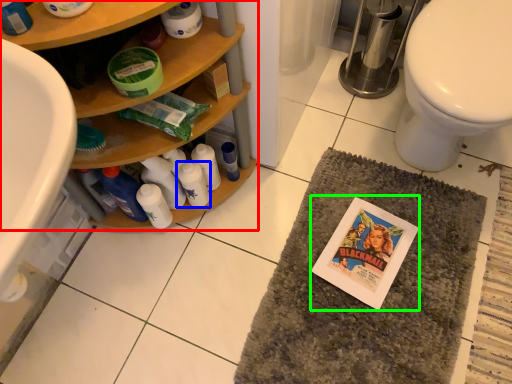
Question: Based on their relative distances, which object is nearer to bathroom cabinet (highlighted by a red box)? Choose from toiletry (highlighted by a blue box) and comic book (highlighted by a green box).

Choices:
 (A) toiletry
 (B) comic book

Answer: (A)